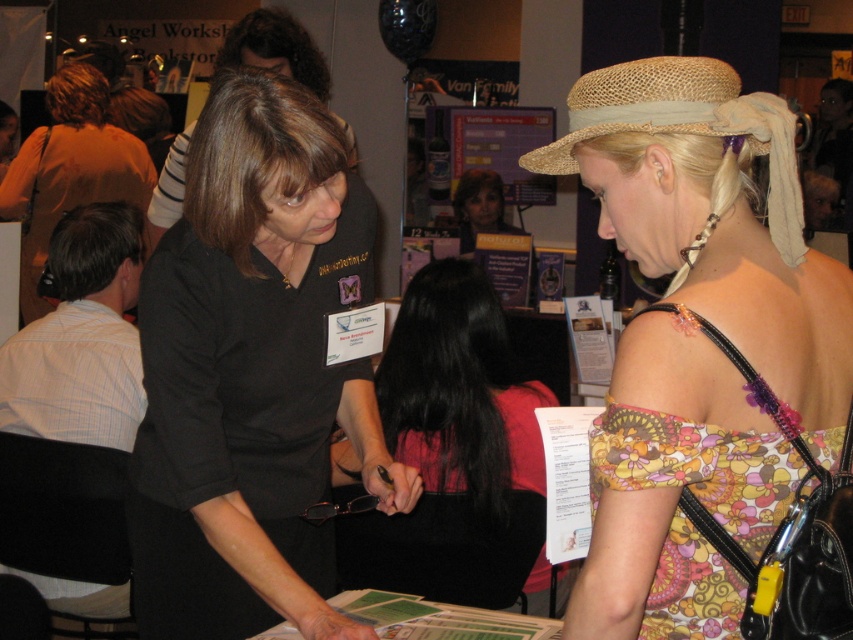
What is located at the coordinates point (x=68, y=170) in the image?

The matte black shirt at left is located at point (x=68, y=170).